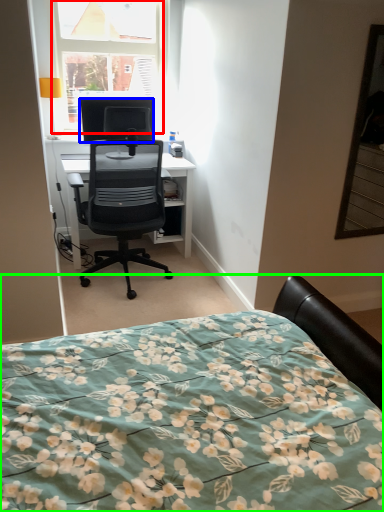
Question: Which is nearer to the window (highlighted by a red box)? television (highlighted by a blue box) or bed (highlighted by a green box).

Choices:
 (A) television
 (B) bed

Answer: (A)